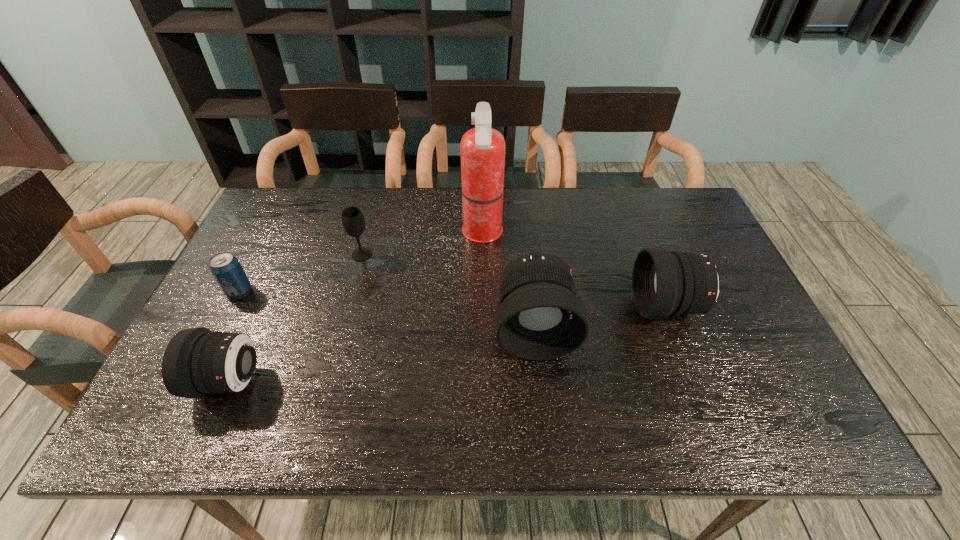
Locate an element on the screen. This screenshot has width=960, height=540. the leftmost telephoto lens is located at coordinates [x=197, y=361].

This screenshot has height=540, width=960. Identify the location of the second telephoto lens from left to right. click(540, 317).

This screenshot has height=540, width=960. I want to click on the second shortest telephoto lens, so click(x=664, y=283).

This screenshot has height=540, width=960. I want to click on the rightmost object, so click(664, 283).

The width and height of the screenshot is (960, 540). Identify the location of the tallest object. (482, 148).

The image size is (960, 540). Find the location of `pop soda`. pop soda is located at coordinates (225, 267).

Where is `wineglass`? Image resolution: width=960 pixels, height=540 pixels. wineglass is located at coordinates (353, 221).

Locate an element on the screen. Image resolution: width=960 pixels, height=540 pixels. vacant area located 0.050m at the front element of the shortest telephoto lens is located at coordinates (178, 381).

Locate an element on the screen. This screenshot has height=540, width=960. vacant position located 0.070m at the front element of the shortest telephoto lens is located at coordinates (169, 381).

Where is `free region located at the front element of the second telephoto lens from left to right`? This screenshot has width=960, height=540. free region located at the front element of the second telephoto lens from left to right is located at coordinates (540, 381).